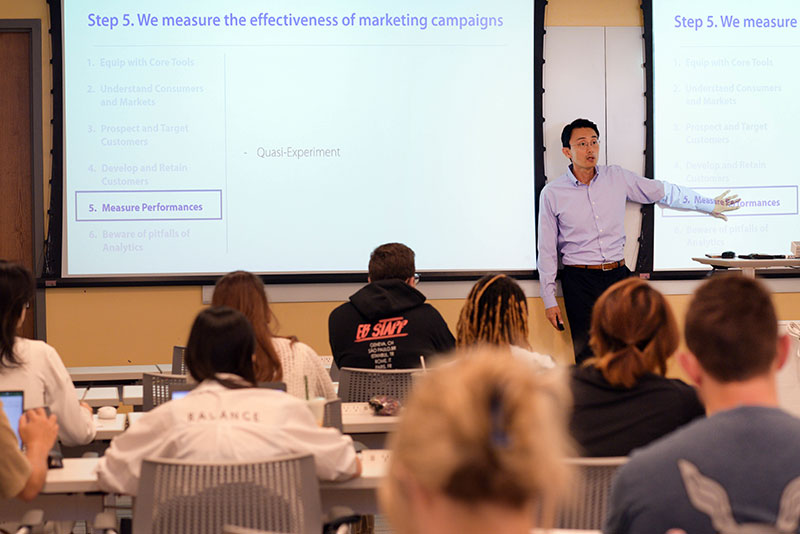
Where is `chairs`? The image size is (800, 534). chairs is located at coordinates (386, 379), (176, 358), (160, 389), (173, 501), (582, 485).